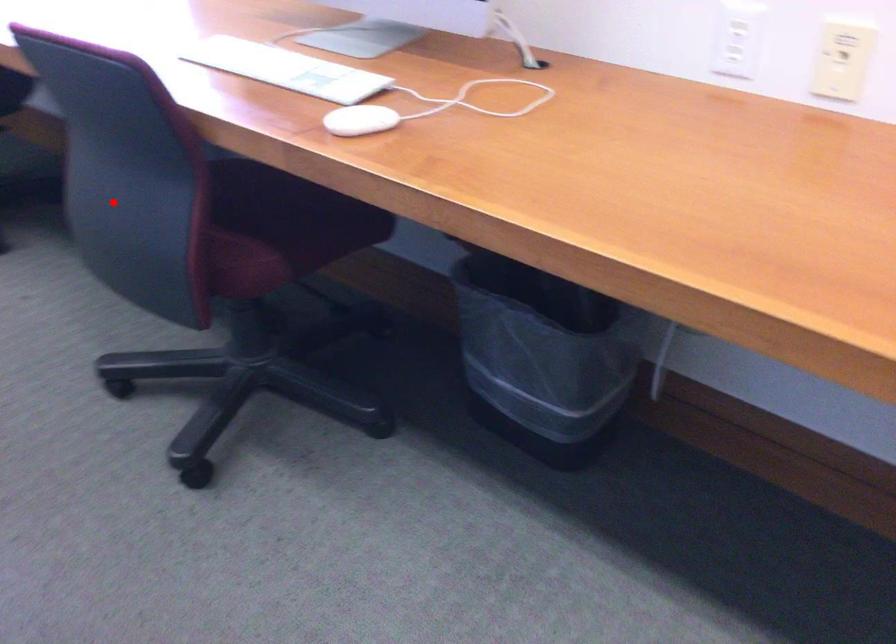
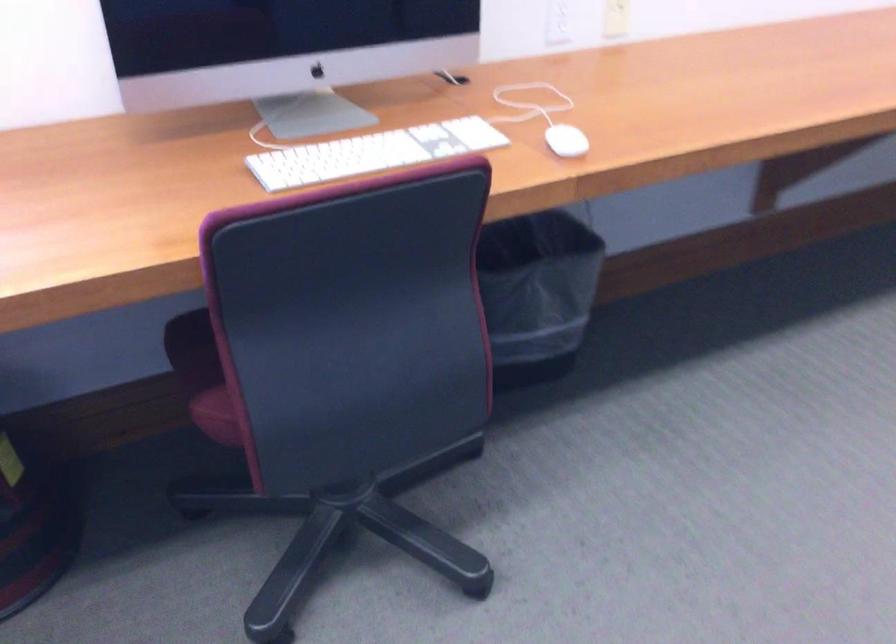
Question: I am providing you with two images of the same scene from different viewpoints. Image1 has a red point marked. In image2, the corresponding 3D location appears at what relative position? Reply with the corresponding letter.

Choices:
 (A) Closer
 (B) Farther

Answer: (A)